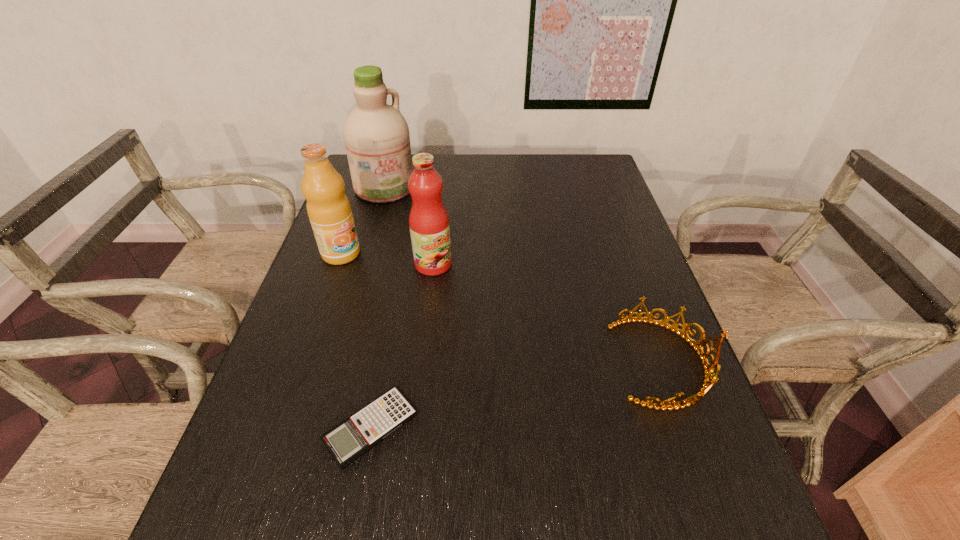
I want to click on vacant space located on the front label of the left fruit juice, so (x=414, y=312).

You are a GUI agent. You are given a task and a screenshot of the screen. Output one action in this format:
    pyautogui.click(x=<x>, y=<y>)
    Task: Click on the free space located 0.230m on the front label of the right fruit juice
    This screenshot has height=540, width=960.
    Given the screenshot: What is the action you would take?
    pyautogui.click(x=483, y=335)

At what (x,y) coordinates should I click in order to perform the action: click on vacant area situated on the front label of the right fruit juice. Please return your answer as a coordinate pair (x, y). Image resolution: width=960 pixels, height=540 pixels. Looking at the image, I should click on pyautogui.click(x=513, y=377).

You are a GUI agent. You are given a task and a screenshot of the screen. Output one action in this format:
    pyautogui.click(x=<x>, y=<y>)
    Task: Click on the vacant region located 0.220m on the front label of the right fruit juice
    This screenshot has width=960, height=540.
    Given the screenshot: What is the action you would take?
    pyautogui.click(x=481, y=332)

Where is `free location located 0.160m on the front label of the farthest object`? free location located 0.160m on the front label of the farthest object is located at coordinates (420, 227).

This screenshot has height=540, width=960. In order to click on vacant region located 0.110m on the front label of the farthest object in this screenshot , I will do `click(413, 219)`.

You are a GUI agent. You are given a task and a screenshot of the screen. Output one action in this format:
    pyautogui.click(x=<x>, y=<y>)
    Task: Click on the free spot located on the front label of the farthest object
    This screenshot has height=540, width=960.
    Given the screenshot: What is the action you would take?
    pyautogui.click(x=426, y=234)

Where is `object at the far edge`? The image size is (960, 540). object at the far edge is located at coordinates (376, 135).

You are a GUI agent. You are given a task and a screenshot of the screen. Output one action in this format:
    pyautogui.click(x=<x>, y=<y>)
    Task: Click on the object that is at the near edge
    This screenshot has height=540, width=960.
    Given the screenshot: What is the action you would take?
    pyautogui.click(x=347, y=441)

Identify the location of calculator at the left edge. (347, 441).